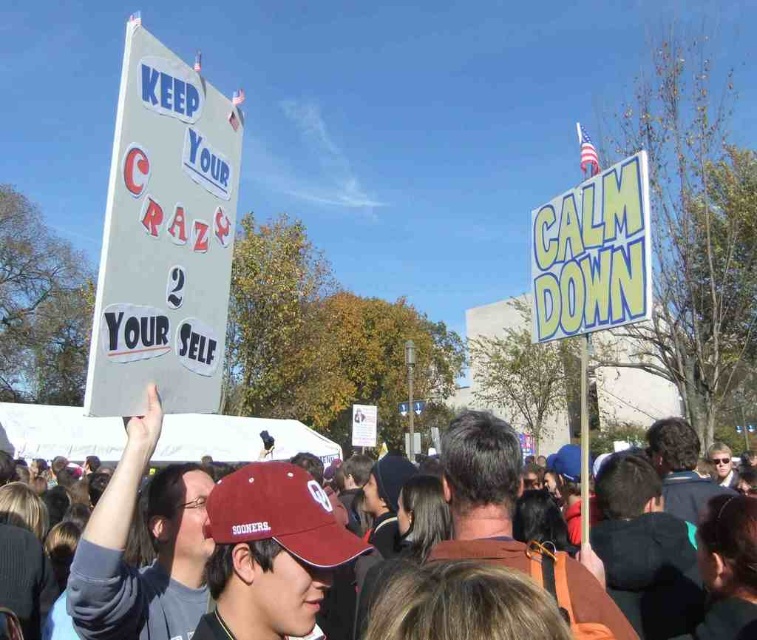
Question: Considering the real-world distances, which object is closest to the white cardboard sign at upper left?

Choices:
 (A) brown leather jacket at center
 (B) yellowmaterial/texturesign at upper right

Answer: (B)

Question: Among these objects, which one is nearest to the camera?

Choices:
 (A) yellowmaterial/texturesign at upper right
 (B) white cardboard sign at upper left

Answer: (B)

Question: Does white cardboard sign at upper left have a larger size compared to brown leather jacket at center?

Choices:
 (A) yes
 (B) no

Answer: (B)

Question: Which of the following is the closest to the observer?

Choices:
 (A) white cardboard sign at upper left
 (B) yellowmaterial/texturesign at upper right
 (C) brown leather jacket at center

Answer: (A)

Question: Is brown leather jacket at center wider than yellowmaterial/texturesign at upper right?

Choices:
 (A) yes
 (B) no

Answer: (A)

Question: Is white cardboard sign at upper left above brown leather jacket at center?

Choices:
 (A) yes
 (B) no

Answer: (A)